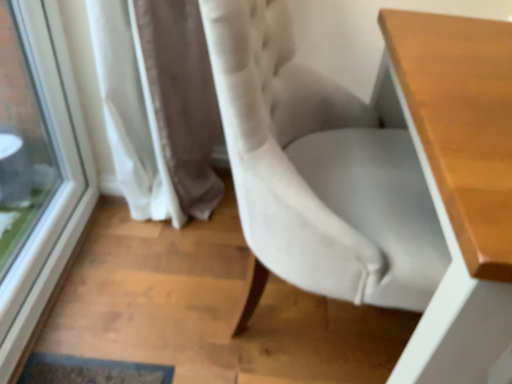
Question: Considering the positions of point (415, 162) and point (167, 9), is point (415, 162) closer or farther from the camera than point (167, 9)?

Choices:
 (A) closer
 (B) farther

Answer: (B)

Question: Relative to white textured curtain at lower left, is velvet white chair at center in front or behind?

Choices:
 (A) behind
 (B) front

Answer: (B)

Question: Estimate the real-world distances between objects in this image. Which object is closer to the wooden table at right?

Choices:
 (A) velvet white chair at center
 (B) white textured curtain at lower left
 (C) transparent glass window at left

Answer: (A)

Question: Based on their relative distances, which object is farther from the velvet white chair at center?

Choices:
 (A) wooden table at right
 (B) transparent glass window at left
 (C) white textured curtain at lower left

Answer: (B)